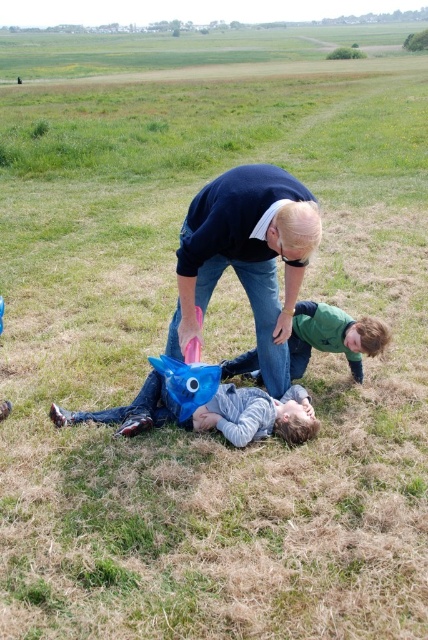
Question: Among these objects, which one is nearest to the camera?

Choices:
 (A) blue fabric bag at center
 (B) green matte shirt at center
 (C) blue matte mask at center

Answer: (A)

Question: Does blue matte mask at center have a lesser width compared to green matte shirt at center?

Choices:
 (A) yes
 (B) no

Answer: (B)

Question: Is blue fabric bag at center behind green matte shirt at center?

Choices:
 (A) yes
 (B) no

Answer: (B)

Question: Among these points, which one is nearest to the camera?

Choices:
 (A) (261, 353)
 (B) (341, 348)

Answer: (A)

Question: Is blue fabric bag at center above blue matte mask at center?

Choices:
 (A) yes
 (B) no

Answer: (A)

Question: Which point is farther to the camera?

Choices:
 (A) blue fabric bag at center
 (B) green matte shirt at center

Answer: (B)